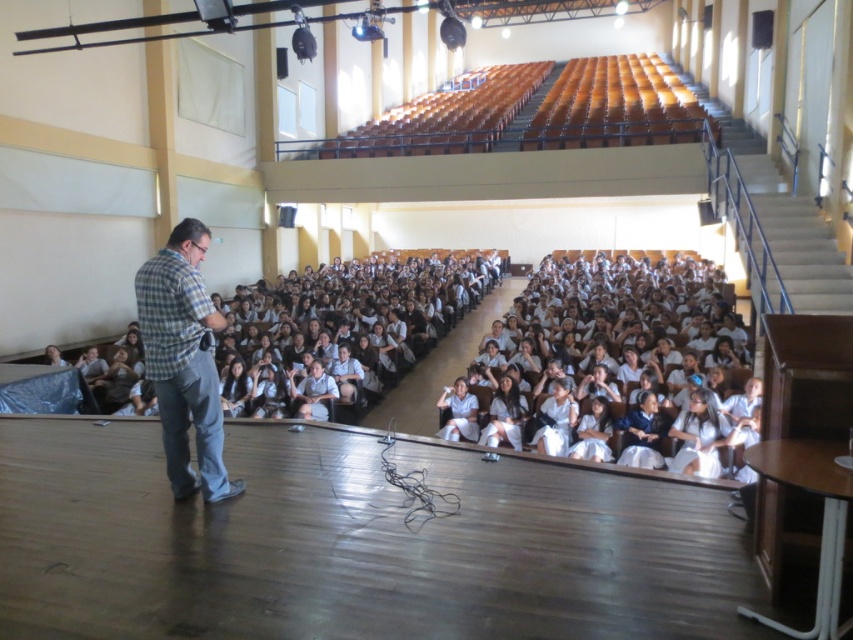
You are a photographer standing at the back of the auditorium. You want to take a photo that includes both the white uniformed students at center and the plaid shirt at left. Which object should be placed lower in the frame to ensure both are visible?

The plaid shirt at left should be placed lower in the frame because the white uniformed students at center are located above it.

You are a stagehand preparing to move a 15 feet long banner from the storage room to the stage. You need to ensure the banner can be displayed without blocking the view of the white uniformed students at center and the plaid shirt at left. Can the banner be placed between them without overlapping either?

The distance between the white uniformed students at center and the plaid shirt at left is 14.66 feet. Since the banner is 15 feet long, it would be slightly too long to fit between them without overlapping one or both, so it cannot be placed there without blocking their view.